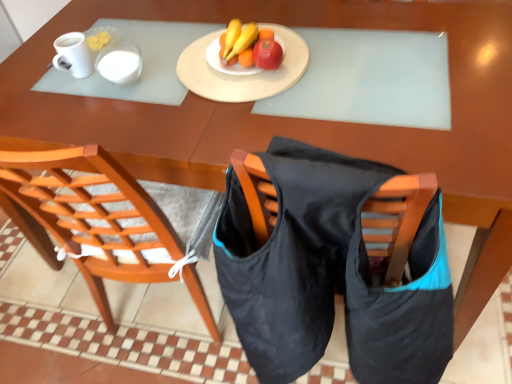
At what (x,y) coordinates should I click in order to perform the action: click on vacant area that is situated to the right of matte yellow banana at center. Please return your answer as a coordinate pair (x, y). Looking at the image, I should click on (317, 49).